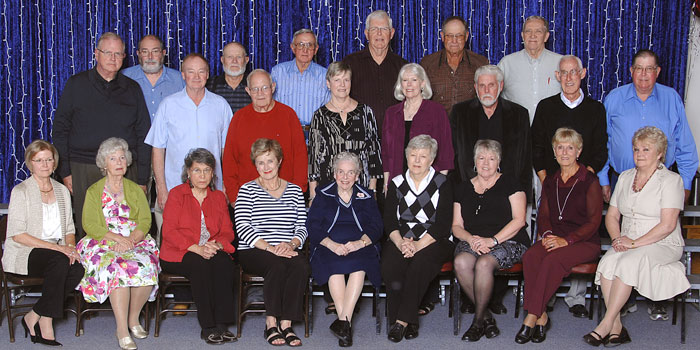
Locate an element on the screen. gray carpet is located at coordinates (183, 333).